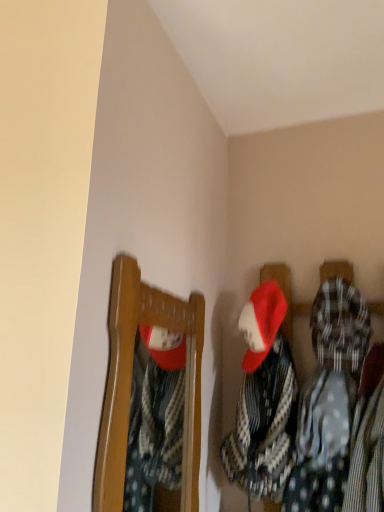
Where is `blank space above matte wooden mirror at upper left (from a real-world perspective)`? blank space above matte wooden mirror at upper left (from a real-world perspective) is located at coordinates (163, 259).